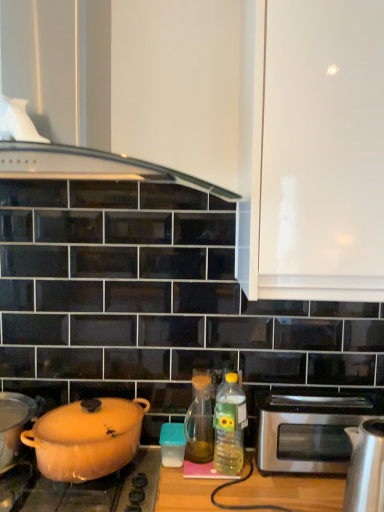
In order to face translucent amber glass at center, the 2th bottle when ordered from right to left, should I rotate leftwards or rightwards?

Turn right by 1.006 degrees to look at translucent amber glass at center, the 2th bottle when ordered from right to left.

Describe the element at coordinates (15, 422) in the screenshot. I see `matte orange pot at left, which appears as the 1th kitchen appliance when viewed from the left` at that location.

Find the location of a particular element. The width and height of the screenshot is (384, 512). matte orange pot at lower left is located at coordinates (94, 490).

What do you see at coordinates (310, 428) in the screenshot?
I see `stainless steel toaster at right` at bounding box center [310, 428].

Locate an element on the screen. The image size is (384, 512). translucent amber glass at center, the 2th bottle when ordered from right to left is located at coordinates (199, 422).

Locate an element on the screen. Image resolution: width=384 pixels, height=512 pixels. the 3rd kitchen appliance in front of the stainless steel toaster at right, counting from the anchor's position is located at coordinates (365, 468).

Considering the positions of objects stainless steel toaster at right and satin silver kettle at right, the 1th kitchen appliance in the right-to-left sequence, in the image provided, who is in front, stainless steel toaster at right or satin silver kettle at right, the 1th kitchen appliance in the right-to-left sequence,?

satin silver kettle at right, the 1th kitchen appliance in the right-to-left sequence, is closer to the camera.

Which object is wider, stainless steel toaster at right or satin silver kettle at right, which appears as the 2th kitchen appliance when ordered from the bottom?

stainless steel toaster at right.

Is point (302, 450) positioned after point (359, 497)?

Yes, it is.

Is translucent plastic bottle at center, the 1th bottle when ordered from right to left, looking in the opposite direction of translucent amber glass at center, the 2th bottle when ordered from right to left?

translucent plastic bottle at center, the 1th bottle when ordered from right to left, is not turned away from translucent amber glass at center, the 2th bottle when ordered from right to left.

Based on the photo, how far apart are translucent plastic bottle at center, acting as the 2th bottle starting from the left, and translucent amber glass at center, which is counted as the first bottle, starting from the left?

translucent plastic bottle at center, acting as the 2th bottle starting from the left, and translucent amber glass at center, which is counted as the first bottle, starting from the left, are 8.62 centimeters apart from each other.

Locate an element on the screen. The height and width of the screenshot is (512, 384). bottle behind the translucent plastic bottle at center, the 1th bottle when ordered from right to left is located at coordinates (199, 422).

Which is more to the left, translucent plastic bottle at center, the 1th bottle when ordered from right to left, or translucent amber glass at center, the 2th bottle when ordered from right to left?

Positioned to the left is translucent amber glass at center, the 2th bottle when ordered from right to left.

Considering the positions of points (27, 407) and (183, 447), is point (27, 407) farther from camera compared to point (183, 447)?

No, it is not.

From the image's perspective, which object appears higher, matte orange pot at left, which appears as the 1th kitchen appliance when viewed from the left, or translucent plastic container at center, acting as the 4th kitchen appliance starting from the left?

matte orange pot at left, which appears as the 1th kitchen appliance when viewed from the left, appears higher in the image.

This screenshot has width=384, height=512. I want to click on the 2nd kitchen appliance positioned below the matte orange pot at left, which ranks as the third kitchen appliance in bottom-to-top order (from the image's perspective), so click(x=172, y=444).

Can you confirm if matte orange pot at left, which is the 5th kitchen appliance from right to left, is thinner than translucent plastic container at center, acting as the second kitchen appliance starting from the right?

No.

How far apart are white glossy cabinet at upper right and matte orange pot at lower left?

white glossy cabinet at upper right and matte orange pot at lower left are 32.10 inches apart.

Does white glossy cabinet at upper right appear on the right side of matte orange pot at lower left?

Yes, white glossy cabinet at upper right is to the right of matte orange pot at lower left.

From a real-world perspective, between white glossy cabinet at upper right and matte orange pot at lower left, who is vertically higher?

In real-world perspective, white glossy cabinet at upper right is above.

Is white glossy cabinet at upper right smaller than matte orange pot at lower left?

No, white glossy cabinet at upper right is not smaller than matte orange pot at lower left.

From the image's perspective, which is below, white glossy vase at upper left, acting as the 4th kitchen appliance starting from the right, or translucent plastic bottle at center, the 1th bottle when ordered from right to left?

translucent plastic bottle at center, the 1th bottle when ordered from right to left, is shown below in the image.

You are a GUI agent. You are given a task and a screenshot of the screen. Output one action in this format:
    pyautogui.click(x=<x>, y=<y>)
    Task: Click on the kitchen appliance that is above the translucent plastic bottle at center, the 1th bottle when ordered from right to left (from the image's perspective)
    This screenshot has height=512, width=384.
    Given the screenshot: What is the action you would take?
    pyautogui.click(x=17, y=122)

From the image's perspective, starting from the matte orange pot at lower left, the 2th kitchen appliance when ordered from top to bottom, which kitchen appliance is the 3rd one below? Please provide its 2D coordinates.

[(172, 444)]

From the image's perspective, is matte orange pot at lower left, which ranks as the 4th kitchen appliance in bottom-to-top order, over translucent plastic container at center, acting as the 4th kitchen appliance starting from the left?

Yes.

In the scene shown: What's the angular difference between matte orange pot at lower left, placed as the 3th kitchen appliance when sorted from right to left, and translucent plastic container at center, acting as the 4th kitchen appliance starting from the left,'s facing directions?

0.37 degrees separate the facing orientations of matte orange pot at lower left, placed as the 3th kitchen appliance when sorted from right to left, and translucent plastic container at center, acting as the 4th kitchen appliance starting from the left.

From the image's perspective, does satin silver kettle at right, marked as the fourth kitchen appliance in a top-to-bottom arrangement, appear lower than white glossy vase at upper left, the second kitchen appliance in the left-to-right sequence?

Yes, from the image's perspective, satin silver kettle at right, marked as the fourth kitchen appliance in a top-to-bottom arrangement, is beneath white glossy vase at upper left, the second kitchen appliance in the left-to-right sequence.

Is satin silver kettle at right, marked as the fourth kitchen appliance in a top-to-bottom arrangement, wider or thinner than white glossy vase at upper left, the second kitchen appliance in the left-to-right sequence?

satin silver kettle at right, marked as the fourth kitchen appliance in a top-to-bottom arrangement, is wider than white glossy vase at upper left, the second kitchen appliance in the left-to-right sequence.

Is satin silver kettle at right, the 5th kitchen appliance when ordered from left to right, at the left side of white glossy vase at upper left, arranged as the 5th kitchen appliance when ordered from the bottom?

Incorrect, satin silver kettle at right, the 5th kitchen appliance when ordered from left to right, is not on the left side of white glossy vase at upper left, arranged as the 5th kitchen appliance when ordered from the bottom.

Does satin silver kettle at right, the 5th kitchen appliance when ordered from left to right, contain white glossy vase at upper left, arranged as the 5th kitchen appliance when ordered from the bottom?

Definitely not — white glossy vase at upper left, arranged as the 5th kitchen appliance when ordered from the bottom, is not inside satin silver kettle at right, the 5th kitchen appliance when ordered from left to right.

Where is `the 1st kitchen appliance above the stainless steel toaster at right (from a real-world perspective)`? the 1st kitchen appliance above the stainless steel toaster at right (from a real-world perspective) is located at coordinates (365, 468).

The height and width of the screenshot is (512, 384). Identify the location of bottle below the translucent plastic bottle at center, the 1th bottle when ordered from right to left (from a real-world perspective). (199, 422).

When comparing their distances from white glossy cabinet at upper right, does translucent plastic bottle at center, the 1th bottle when ordered from right to left, or matte orange pot at lower left, which ranks as the 4th kitchen appliance in bottom-to-top order, seem further?

The object further to white glossy cabinet at upper right is matte orange pot at lower left, which ranks as the 4th kitchen appliance in bottom-to-top order.

Based on the photo, when comparing their distances from translucent plastic container at center, acting as the second kitchen appliance starting from the right, does satin silver kettle at right, the 5th kitchen appliance when ordered from left to right, or matte orange pot at lower left seem closer?

Among the two, matte orange pot at lower left is located nearer to translucent plastic container at center, acting as the second kitchen appliance starting from the right.

Estimate the real-world distances between objects in this image. Which object is further from matte orange pot at left, which is the 5th kitchen appliance from right to left, matte orange pot at lower left or satin silver kettle at right, the 5th kitchen appliance when ordered from left to right?

satin silver kettle at right, the 5th kitchen appliance when ordered from left to right, is positioned further to the anchor matte orange pot at left, which is the 5th kitchen appliance from right to left.

When comparing their distances from translucent plastic container at center, positioned as the fifth kitchen appliance in top-to-bottom order, does satin silver kettle at right, the 5th kitchen appliance when ordered from left to right, or matte orange pot at lower left, the 2th kitchen appliance when ordered from top to bottom, seem further?

satin silver kettle at right, the 5th kitchen appliance when ordered from left to right, is positioned further to the anchor translucent plastic container at center, positioned as the fifth kitchen appliance in top-to-bottom order.

Looking at the image, which one is located closer to white glossy cabinet at upper right, matte orange pot at lower left, the 2th kitchen appliance when ordered from top to bottom, or white glossy vase at upper left, arranged as the 5th kitchen appliance when ordered from the bottom?

Among the two, white glossy vase at upper left, arranged as the 5th kitchen appliance when ordered from the bottom, is located nearer to white glossy cabinet at upper right.

Estimate the real-world distances between objects in this image. Which object is further from translucent plastic bottle at center, the 1th bottle when ordered from right to left, white glossy cabinet at upper right or translucent plastic container at center, positioned as the fifth kitchen appliance in top-to-bottom order?

white glossy cabinet at upper right.

From the image, which object appears to be nearer to matte orange pot at left, which ranks as the third kitchen appliance in bottom-to-top order, matte orange pot at lower left, which ranks as the 4th kitchen appliance in bottom-to-top order, or satin silver kettle at right, the 1th kitchen appliance in the right-to-left sequence?

matte orange pot at lower left, which ranks as the 4th kitchen appliance in bottom-to-top order.

From the image, which object appears to be farther from stainless steel toaster at right, translucent plastic bottle at center, the 1th bottle when ordered from right to left, or translucent plastic container at center, acting as the 4th kitchen appliance starting from the left?

translucent plastic container at center, acting as the 4th kitchen appliance starting from the left, lies further to stainless steel toaster at right than the other object.

Find the location of a particular element. Image resolution: width=384 pixels, height=512 pixels. bottle between matte orange pot at left, which appears as the 1th kitchen appliance when viewed from the left, and translucent plastic bottle at center, acting as the 2th bottle starting from the left, from left to right is located at coordinates (199, 422).

At what (x,y) coordinates should I click in order to perform the action: click on bottle between matte orange pot at lower left, placed as the 3th kitchen appliance when sorted from right to left, and translucent plastic bottle at center, acting as the 2th bottle starting from the left, from left to right. Please return your answer as a coordinate pair (x, y). The width and height of the screenshot is (384, 512). Looking at the image, I should click on (199, 422).

Identify the location of oven located between translucent plastic container at center, acting as the second kitchen appliance starting from the right, and satin silver kettle at right, which appears as the 2th kitchen appliance when ordered from the bottom, in the left-right direction. (310, 428).

Find the location of a particular element. oven between white glossy cabinet at upper right and matte orange pot at lower left vertically is located at coordinates (310, 428).